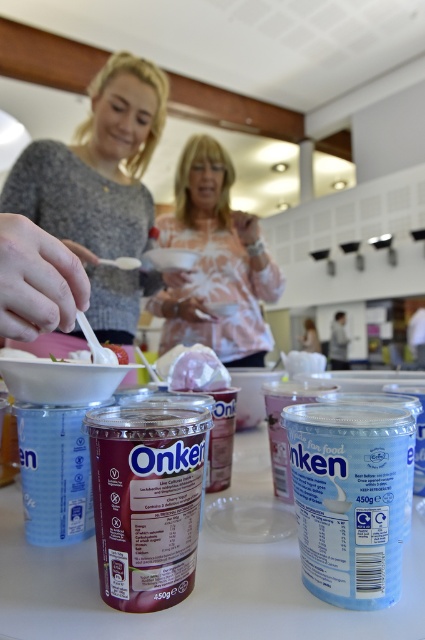
You are a chef preparing a dish and see the matte gray sweater at upper left and the white matte chicken at center in your kitchen. Which object is covering the other?

The matte gray sweater at upper left is positioned over the white matte chicken at center, so it is covering it.